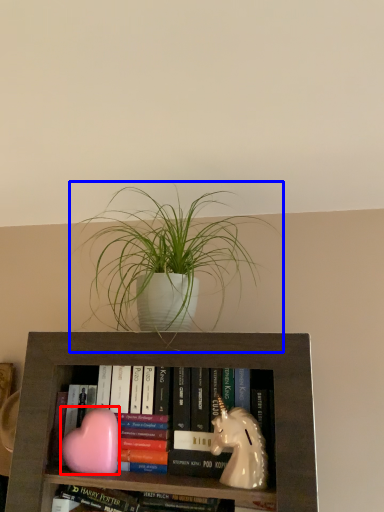
Question: Which point is closer to the camera, animal (highlighted by a red box) or houseplant (highlighted by a blue box)?

Choices:
 (A) animal
 (B) houseplant

Answer: (B)